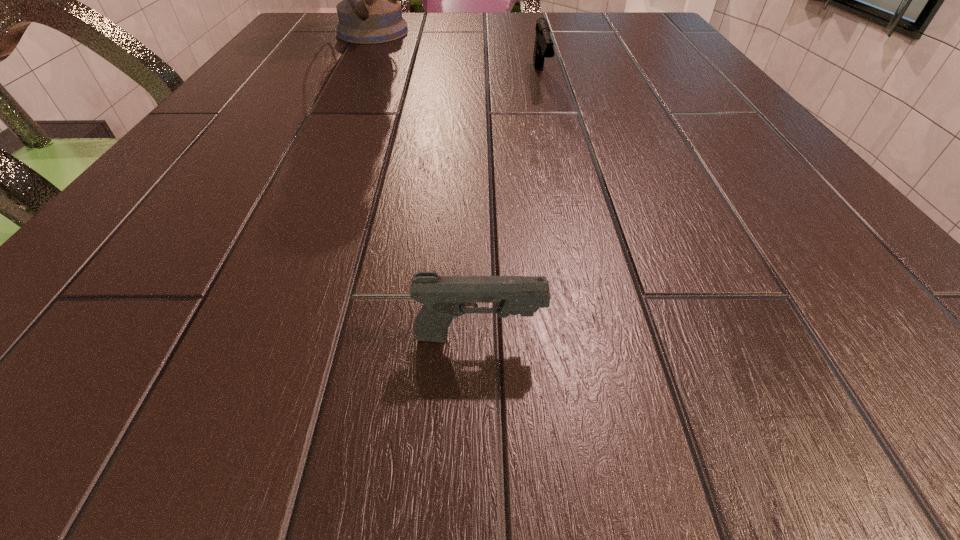
I want to click on unoccupied position between the nearer pistol and the leftmost object, so click(423, 184).

Find the location of a particular element. Image resolution: width=960 pixels, height=540 pixels. free space between the nearer pistol and the tallest object is located at coordinates point(423,184).

Where is `free space between the nearer pistol and the second nearest object`? free space between the nearer pistol and the second nearest object is located at coordinates (510, 207).

Locate an element on the screen. The height and width of the screenshot is (540, 960). empty space between the rightmost object and the leftmost object is located at coordinates (455, 55).

The height and width of the screenshot is (540, 960). I want to click on vacant space that's between the rightmost object and the leftmost object, so click(x=455, y=55).

I want to click on unoccupied position between the second object from left to right and the farther pistol, so click(510, 207).

At what (x,y) coordinates should I click in order to perform the action: click on vacant region between the tallest object and the nearest object. Please return your answer as a coordinate pair (x, y). Looking at the image, I should click on (423, 184).

This screenshot has width=960, height=540. Find the location of `free spot between the oil lamp and the farther pistol`. free spot between the oil lamp and the farther pistol is located at coordinates (455, 55).

At what (x,y) coordinates should I click in order to perform the action: click on vacant area that lies between the rightmost object and the leftmost object. Please return your answer as a coordinate pair (x, y). Looking at the image, I should click on point(455,55).

You are a GUI agent. You are given a task and a screenshot of the screen. Output one action in this format:
    pyautogui.click(x=<x>, y=<y>)
    Task: Click on the object that can be found as the second closest to the leftmost object
    The height and width of the screenshot is (540, 960).
    Given the screenshot: What is the action you would take?
    pyautogui.click(x=443, y=297)